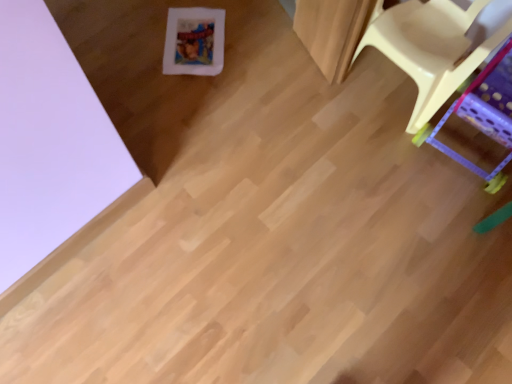
Question: Do you think yellow plastic chair at right, marked as the second furniture in a left-to-right arrangement, is within matte plastic chair at right, the 2th furniture viewed from the right, or outside of it?

Choices:
 (A) outside
 (B) inside

Answer: (A)

Question: From a real-world perspective, is yellow plastic chair at right, which appears as the 1th furniture when viewed from the right, positioned above or below matte plastic chair at right, which is the first furniture from left to right?

Choices:
 (A) below
 (B) above

Answer: (A)

Question: From their relative heights in the image, would you say yellow plastic chair at right, marked as the second furniture in a left-to-right arrangement, is taller or shorter than matte plastic chair at right, which is the first furniture from left to right?

Choices:
 (A) tall
 (B) short

Answer: (B)

Question: From the image's perspective, is matte plastic chair at right, which is the first furniture from left to right, above or below yellow plastic chair at right, which appears as the 1th furniture when viewed from the right?

Choices:
 (A) above
 (B) below

Answer: (A)

Question: Is point (370, 34) closer or farther from the camera than point (481, 92)?

Choices:
 (A) farther
 (B) closer

Answer: (B)

Question: Is matte plastic chair at right, the 2th furniture viewed from the right, wider or thinner than yellow plastic chair at right, marked as the second furniture in a left-to-right arrangement?

Choices:
 (A) thin
 (B) wide

Answer: (A)

Question: Choose the correct answer: Is matte plastic chair at right, the 2th furniture viewed from the right, inside yellow plastic chair at right, marked as the second furniture in a left-to-right arrangement, or outside it?

Choices:
 (A) inside
 (B) outside

Answer: (B)